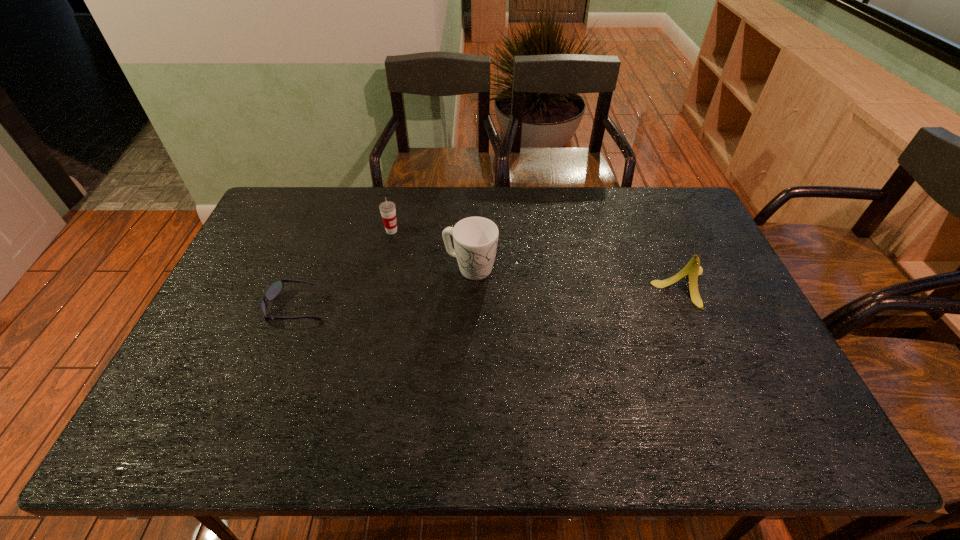
Where is `vacant space on the desktop that is between the leftmost object and the rightmost object and is positioned on the side of the farthest object with the logo`? The image size is (960, 540). vacant space on the desktop that is between the leftmost object and the rightmost object and is positioned on the side of the farthest object with the logo is located at coordinates (542, 294).

Locate an element on the screen. vacant space on the desktop that is between the leftmost object and the banana and is positioned on the side of the mug with the handle is located at coordinates (534, 295).